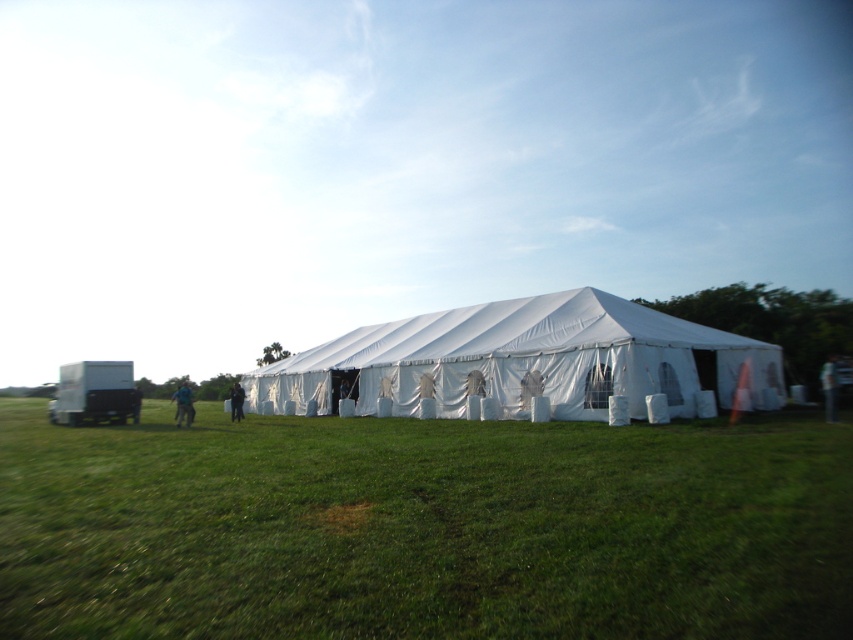
Does green fabric person at right lie in front of blue fabric person at lower left?

Yes, green fabric person at right is closer to the viewer.

Can you confirm if green fabric person at right is positioned to the left of blue fabric person at lower left?

No, green fabric person at right is not to the left of blue fabric person at lower left.

Which is in front, point (825, 394) or point (183, 410)?

Point (825, 394)

In order to click on green fabric person at right in this screenshot , I will do `click(828, 387)`.

Consider the image. Can you confirm if green grass at lower center is thinner than white fabric tent at center?

Correct, green grass at lower center's width is less than white fabric tent at center's.

Who is shorter, green grass at lower center or white fabric tent at center?

green grass at lower center

Where is `green grass at lower center`? The width and height of the screenshot is (853, 640). green grass at lower center is located at coordinates (422, 528).

Locate an element on the screen. The height and width of the screenshot is (640, 853). green grass at lower center is located at coordinates (422, 528).

How much distance is there between green grass at lower center and dark blue fabric at center?

52.23 feet

Does green grass at lower center come in front of dark blue fabric at center?

That is True.

Identify the location of green grass at lower center. (422, 528).